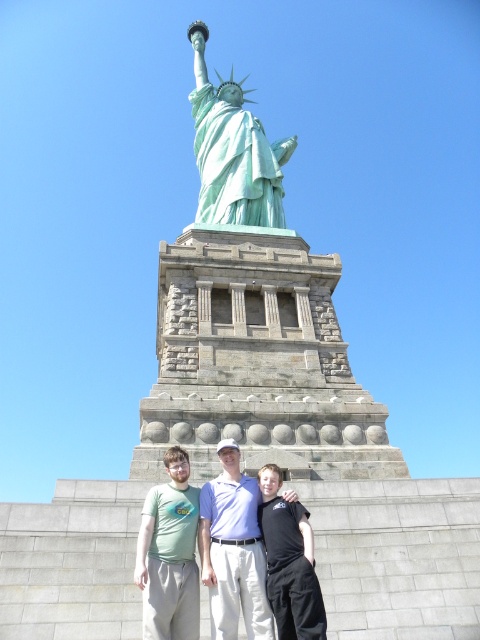
Question: Which is nearer to the black cotton shirt at center?

Choices:
 (A) light blue shirt at center
 (B) green patina statue at center
 (C) green matte t-shirt at center

Answer: (A)

Question: Can you confirm if light blue shirt at center is positioned above green matte t-shirt at center?

Choices:
 (A) no
 (B) yes

Answer: (B)

Question: Estimate the real-world distances between objects in this image. Which object is farther from the green patina statue at center?

Choices:
 (A) green matte t-shirt at center
 (B) light blue shirt at center

Answer: (B)

Question: Where is green matte t-shirt at center located in relation to black cotton shirt at center in the image?

Choices:
 (A) left
 (B) right

Answer: (A)

Question: Does green patina statue at center appear under green matte t-shirt at center?

Choices:
 (A) no
 (B) yes

Answer: (A)

Question: Which object is farther from the camera taking this photo?

Choices:
 (A) green patina statue at center
 (B) black cotton shirt at center

Answer: (A)